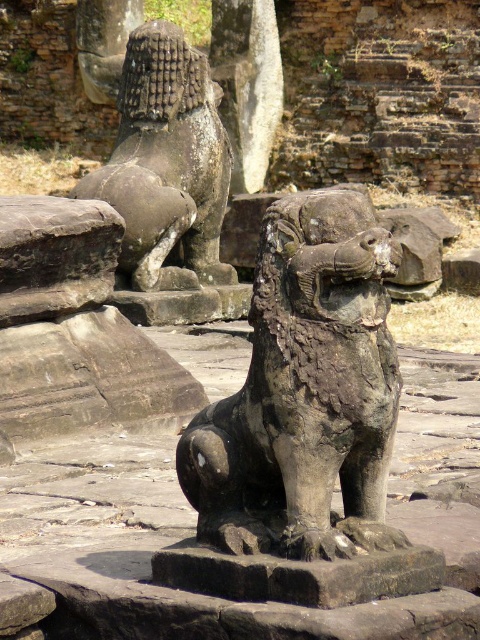
Question: Does stone textured lion at center have a smaller size compared to gray stone lion at upper left?

Choices:
 (A) no
 (B) yes

Answer: (B)

Question: Can you confirm if stone textured lion at center is positioned to the left of gray stone lion at upper left?

Choices:
 (A) no
 (B) yes

Answer: (A)

Question: Which point is farther to the camera?

Choices:
 (A) gray stone lion at upper left
 (B) stone textured lion at center

Answer: (A)

Question: Which object appears farthest from the camera in this image?

Choices:
 (A) gray stone lion at upper left
 (B) stone textured lion at center

Answer: (A)

Question: Can you confirm if stone textured lion at center is positioned to the left of gray stone lion at upper left?

Choices:
 (A) no
 (B) yes

Answer: (A)

Question: Among these points, which one is farthest from the camera?

Choices:
 (A) (277, 513)
 (B) (182, 58)

Answer: (B)